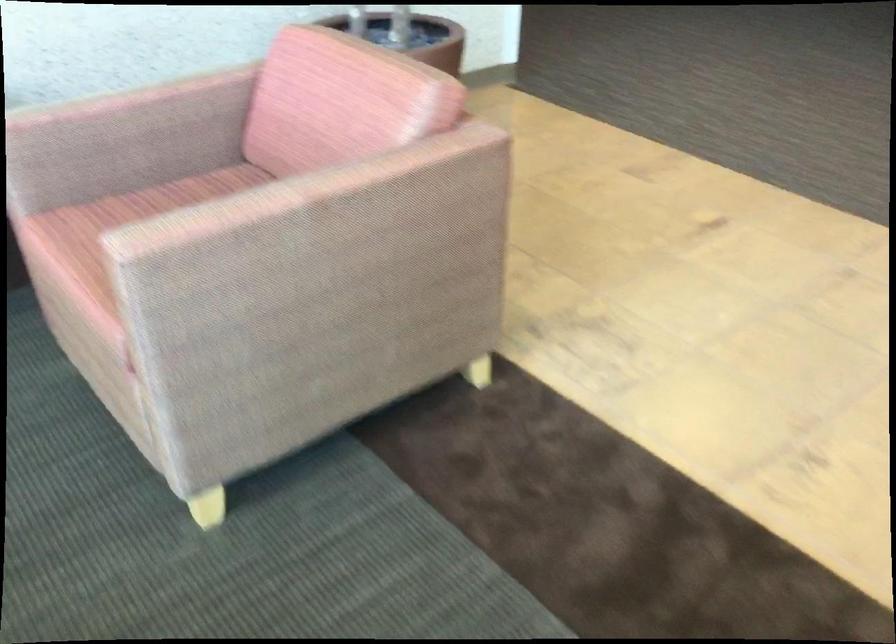
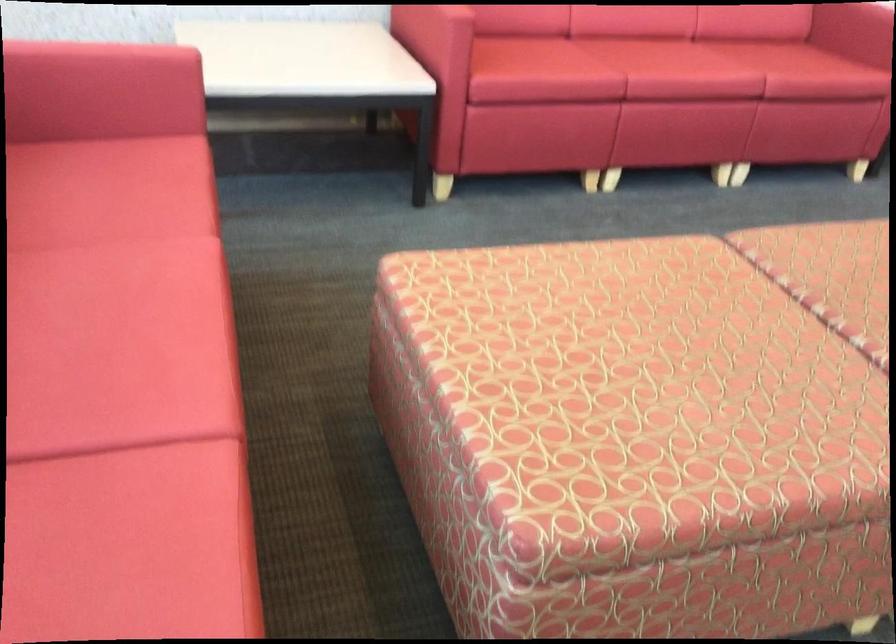
The images are taken continuously from a first-person perspective. In which direction are you moving?

The cameraman moved toward left, backward.